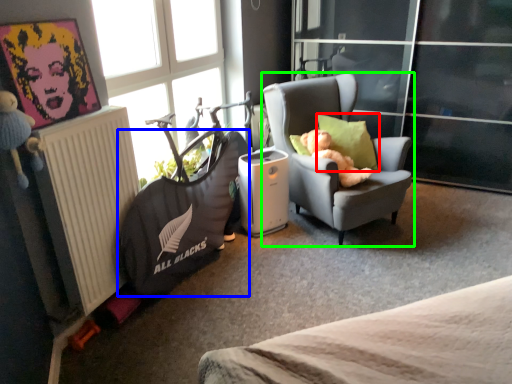
Question: Estimate the real-world distances between objects in this image. Which object is farther from pillow (highlighted by a red box), bean bag chair (highlighted by a blue box) or chair (highlighted by a green box)?

Choices:
 (A) bean bag chair
 (B) chair

Answer: (A)